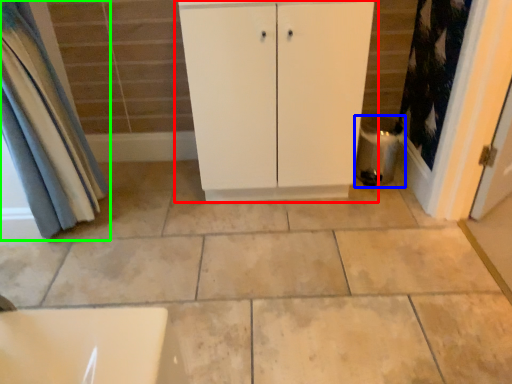
Question: Estimate the real-world distances between objects in this image. Which object is closer to bathroom cabinet (highlighted by a red box), water heater (highlighted by a blue box) or curtain (highlighted by a green box)?

Choices:
 (A) water heater
 (B) curtain

Answer: (A)